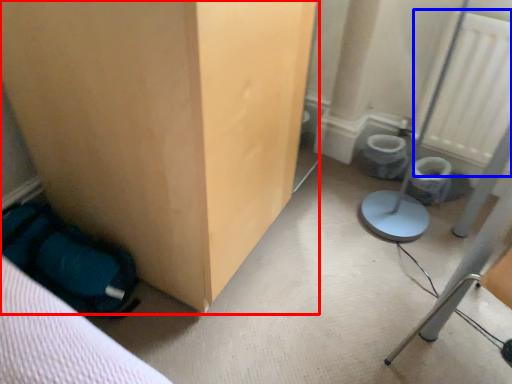
Question: Which object is closer to the camera taking this photo, furniture (highlighted by a red box) or radiator (highlighted by a blue box)?

Choices:
 (A) furniture
 (B) radiator

Answer: (A)